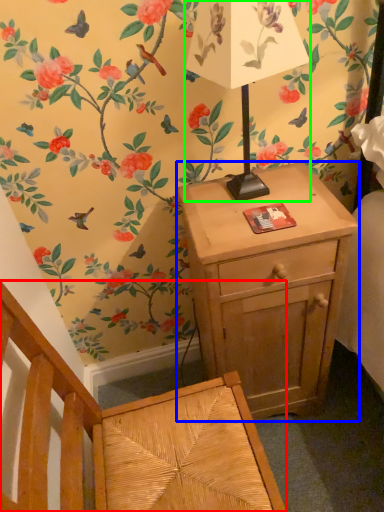
Question: Which object is positioned closest to armchair (highlighted by a red box)? Select from nightstand (highlighted by a blue box) and table lamp (highlighted by a green box).

Choices:
 (A) nightstand
 (B) table lamp

Answer: (A)